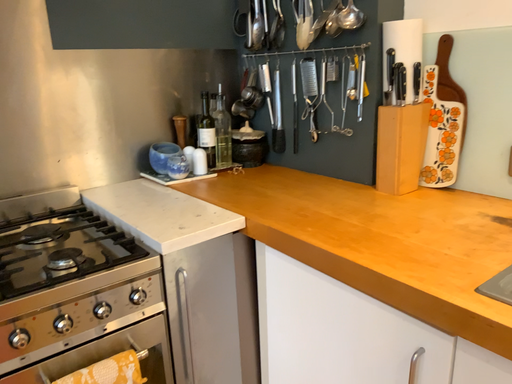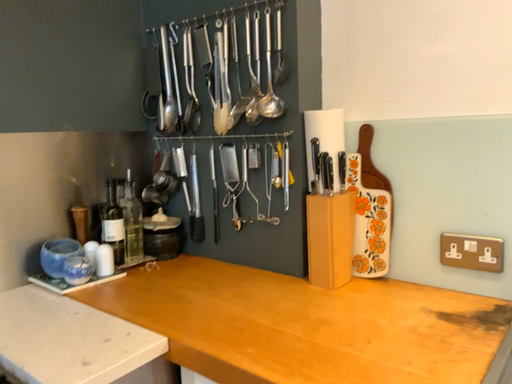
Question: Which way did the camera rotate in the video?

Choices:
 (A) rotated right
 (B) rotated left

Answer: (A)